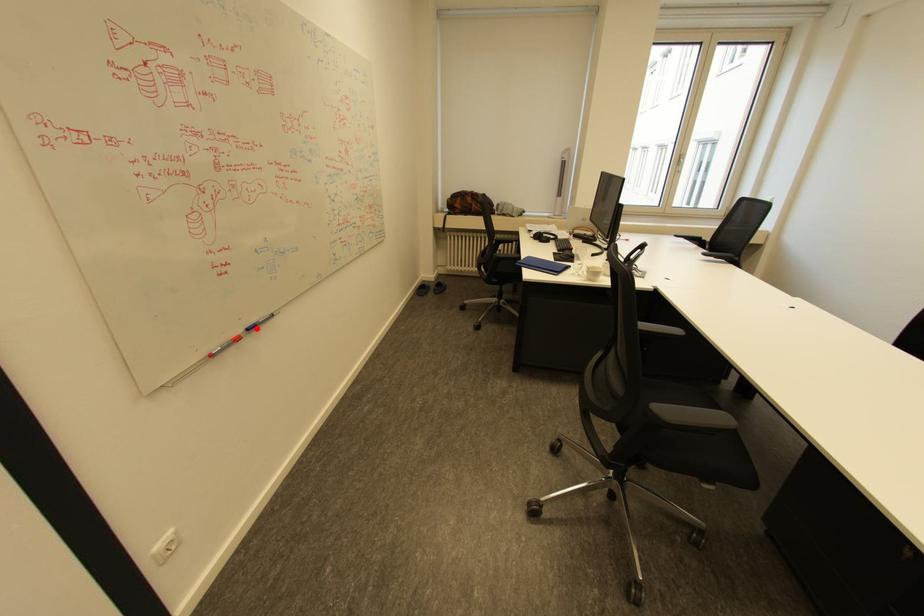
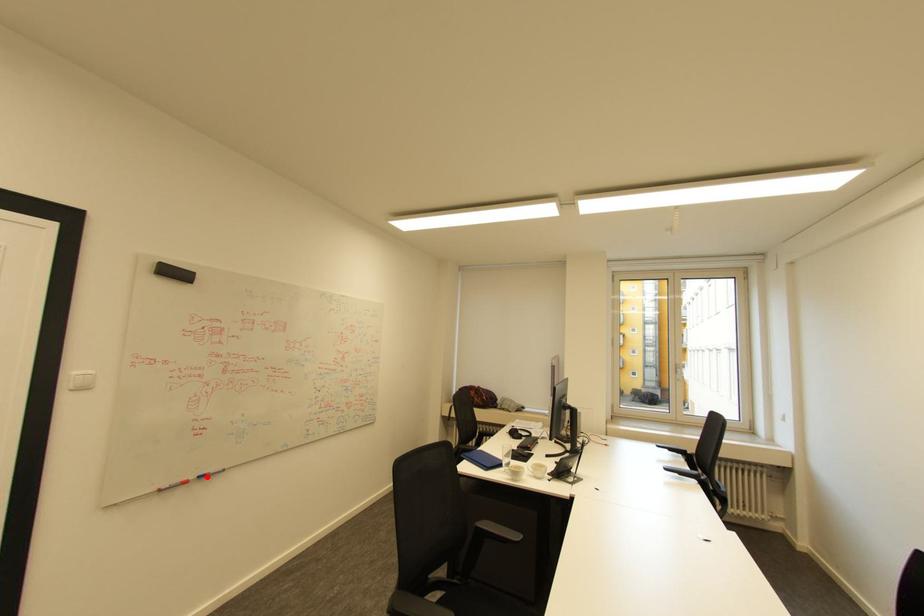
I am providing you with two images of the same scene from different viewpoints. A red point is marked on the first image and another point is marked on the second image. Is the red point in image1 aligned with the point shown in image2?

Yes